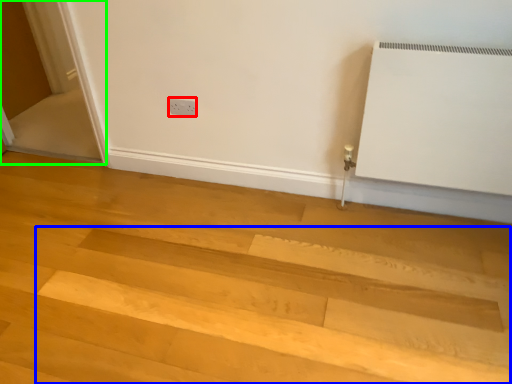
Question: Estimate the real-world distances between objects in this image. Which object is closer to electric outlet (highlighted by a red box), stairwell (highlighted by a blue box) or screen door (highlighted by a green box)?

Choices:
 (A) stairwell
 (B) screen door

Answer: (A)